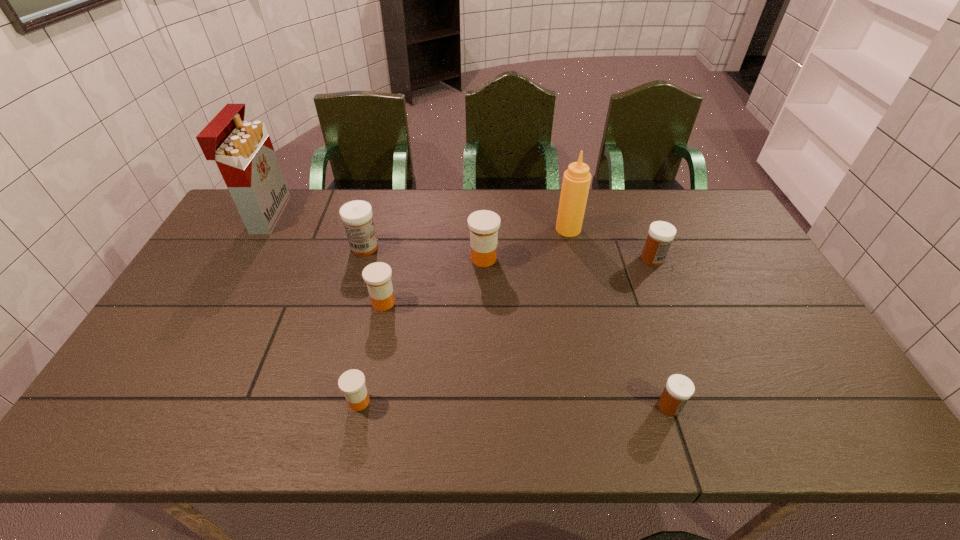
You are a GUI agent. You are given a task and a screenshot of the screen. Output one action in this format:
    pyautogui.click(x=<x>, y=<y>)
    Task: Click on the vacant area that satisfies the following two spatial constraints: 1. on the back side of the rightmost medicine; 2. on the label of the rightmost orange medicine
    Image resolution: width=960 pixels, height=540 pixels.
    Given the screenshot: What is the action you would take?
    pyautogui.click(x=652, y=259)

This screenshot has width=960, height=540. Find the location of `vacant space that satisfies the following two spatial constraints: 1. with the lid open on the tan condiment; 2. on the left side of the tallest object`. vacant space that satisfies the following two spatial constraints: 1. with the lid open on the tan condiment; 2. on the left side of the tallest object is located at coordinates (259, 229).

At what (x,y) coordinates should I click in order to perform the action: click on vacant space that satisfies the following two spatial constraints: 1. on the front side of the leftmost white medicine; 2. on the right side of the smallest white medicine. Please return your answer as a coordinate pair (x, y). The width and height of the screenshot is (960, 540). Looking at the image, I should click on [320, 406].